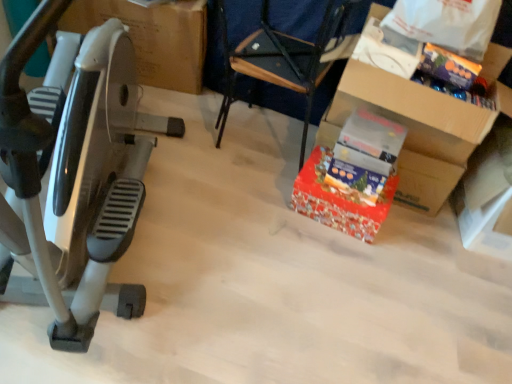
Locate an element on the screen. Image resolution: width=512 pixels, height=384 pixels. free point to the left of blue fabric armchair at center is located at coordinates (194, 116).